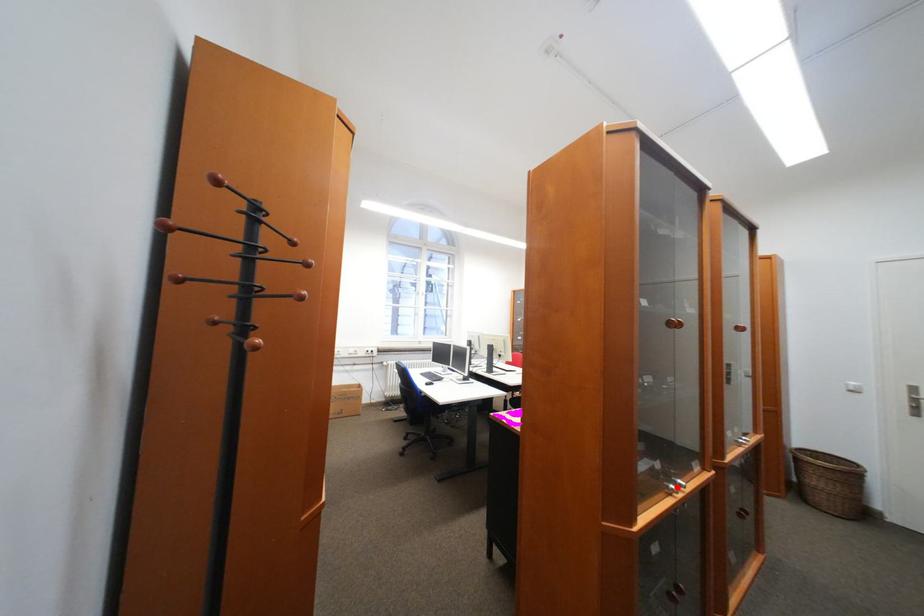
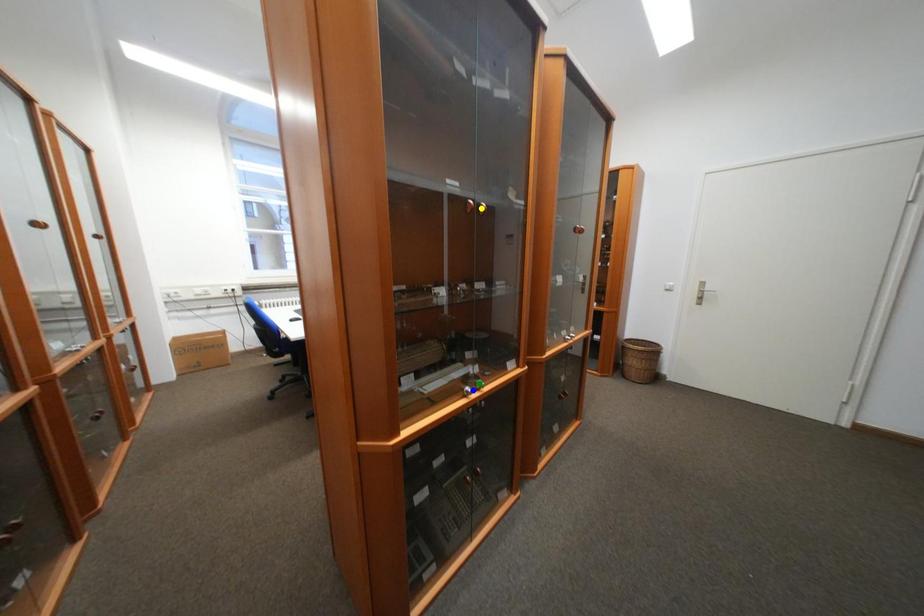
Question: I am providing you with two images of the same scene from different viewpoints. A red point is marked on the first image. You are given multiple points on the second image. Can you choose the point in image 2 that corresponds to the point in image 1?

Choices:
 (A) green point
 (B) blue point
 (C) yellow point

Answer: (B)